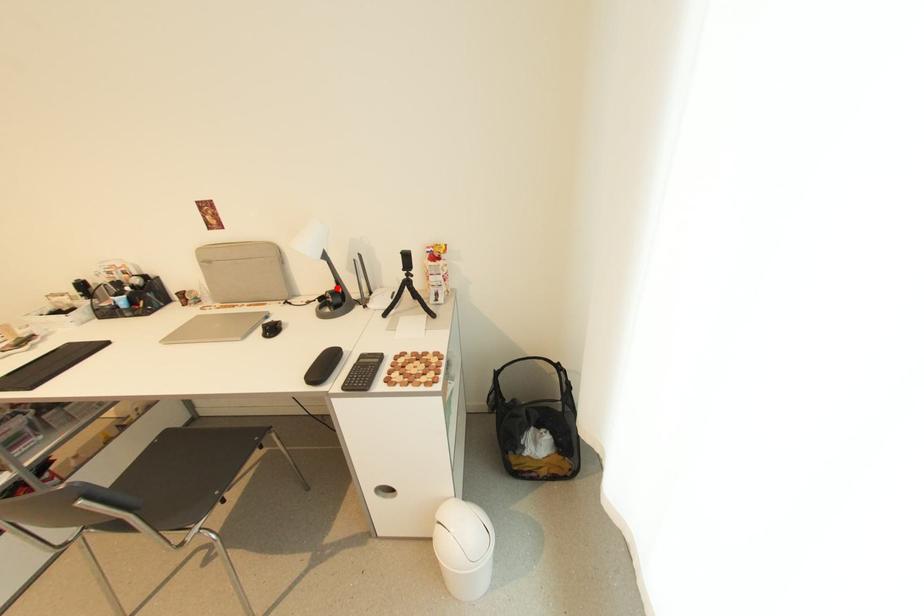
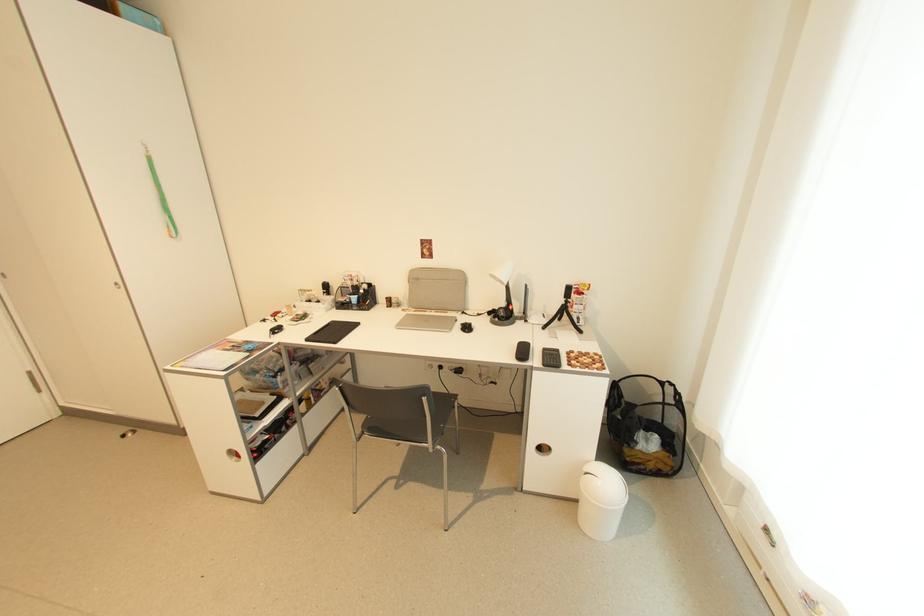
In the second image, find the point that corresponds to the highlighted location in the first image.

(507, 306)